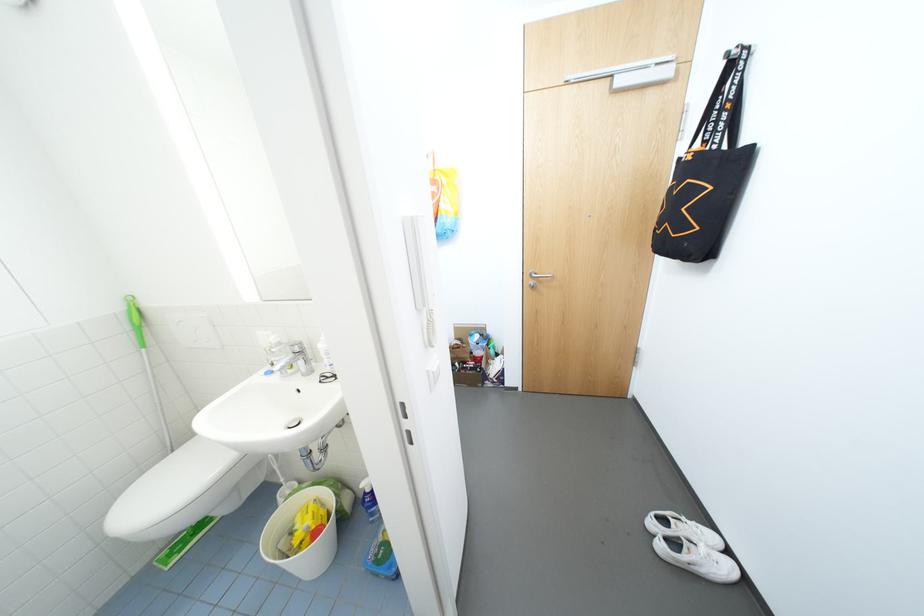
Describe the element at coordinates (176, 490) in the screenshot. I see `the white toilet lid` at that location.